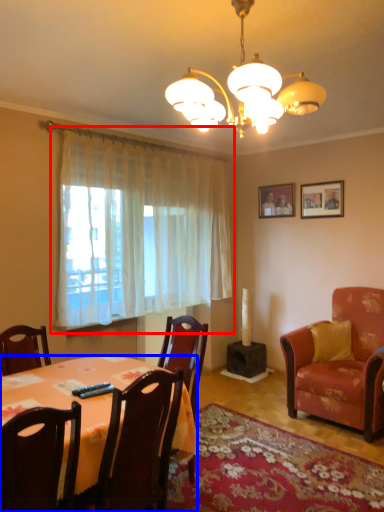
Question: Which point is further to the camera, curtain (highlighted by a red box) or kitchen & dining room table (highlighted by a blue box)?

Choices:
 (A) curtain
 (B) kitchen & dining room table

Answer: (A)